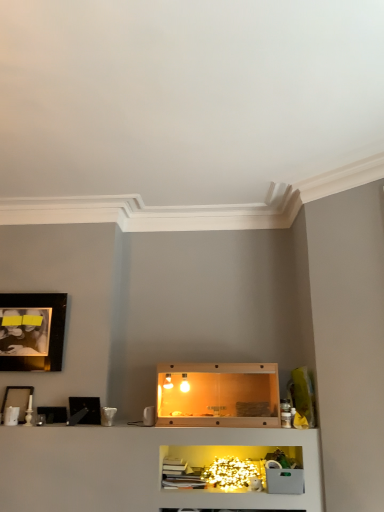
Question: Can you confirm if black glossy picture frame at left, acting as the third picture frame starting from the top, is positioned to the left of matte black picture frame at upper left, which is counted as the second picture frame, starting from the top?

Choices:
 (A) no
 (B) yes

Answer: (A)

Question: From the image's perspective, is black glossy picture frame at left, the first picture frame from the bottom, located beneath matte black picture frame at upper left, placed as the second picture frame when sorted from bottom to top?

Choices:
 (A) no
 (B) yes

Answer: (B)

Question: Is matte black picture frame at upper left, positioned as the first picture frame in left-to-right order, surrounded by black glossy picture frame at left, which is the 3th picture frame in left-to-right order?

Choices:
 (A) yes
 (B) no

Answer: (B)

Question: Would you say black glossy picture frame at left, the first picture frame from the bottom, is a long distance from matte black picture frame at upper left, positioned as the first picture frame in left-to-right order?

Choices:
 (A) yes
 (B) no

Answer: (B)

Question: From a real-world perspective, is black glossy picture frame at left, which is the 3th picture frame in left-to-right order, below matte black picture frame at upper left, which is counted as the second picture frame, starting from the top?

Choices:
 (A) no
 (B) yes

Answer: (B)

Question: Is black glossy picture frame at left, which is the 3th picture frame in left-to-right order, in front of or behind translucent glass shelf at center in the image?

Choices:
 (A) behind
 (B) front

Answer: (A)

Question: Considering the positions of black glossy picture frame at left, arranged as the first picture frame when viewed from the right, and translucent glass shelf at center in the image, is black glossy picture frame at left, arranged as the first picture frame when viewed from the right, taller or shorter than translucent glass shelf at center?

Choices:
 (A) short
 (B) tall

Answer: (A)

Question: From a real-world perspective, is black glossy picture frame at left, which is the 3th picture frame in left-to-right order, above or below translucent glass shelf at center?

Choices:
 (A) below
 (B) above

Answer: (A)

Question: Considering the positions of point 71,410 and point 216,380, is point 71,410 closer or farther from the camera than point 216,380?

Choices:
 (A) closer
 (B) farther

Answer: (A)

Question: Is black glossy picture frame at left, acting as the third picture frame starting from the top, taller or shorter than matte black picture frame at upper left, placed as the second picture frame when sorted from bottom to top?

Choices:
 (A) short
 (B) tall

Answer: (A)

Question: Does point (91, 403) appear closer or farther from the camera than point (3, 413)?

Choices:
 (A) closer
 (B) farther

Answer: (B)

Question: From a real-world perspective, relative to matte black picture frame at upper left, which is counted as the second picture frame, starting from the top, is black glossy picture frame at left, which is the 3th picture frame in left-to-right order, vertically above or below?

Choices:
 (A) above
 (B) below

Answer: (B)

Question: Looking at their shapes, would you say black glossy picture frame at left, which is the 3th picture frame in left-to-right order, is wider or thinner than matte black picture frame at upper left, which is counted as the second picture frame, starting from the top?

Choices:
 (A) thin
 (B) wide

Answer: (B)

Question: In the image, is translucent glass shelf at center positioned in front of or behind black glossy picture frame at left, arranged as the first picture frame when viewed from the right?

Choices:
 (A) front
 (B) behind

Answer: (A)

Question: From a real-world perspective, relative to black glossy picture frame at left, the first picture frame from the bottom, is translucent glass shelf at center vertically above or below?

Choices:
 (A) above
 (B) below

Answer: (A)